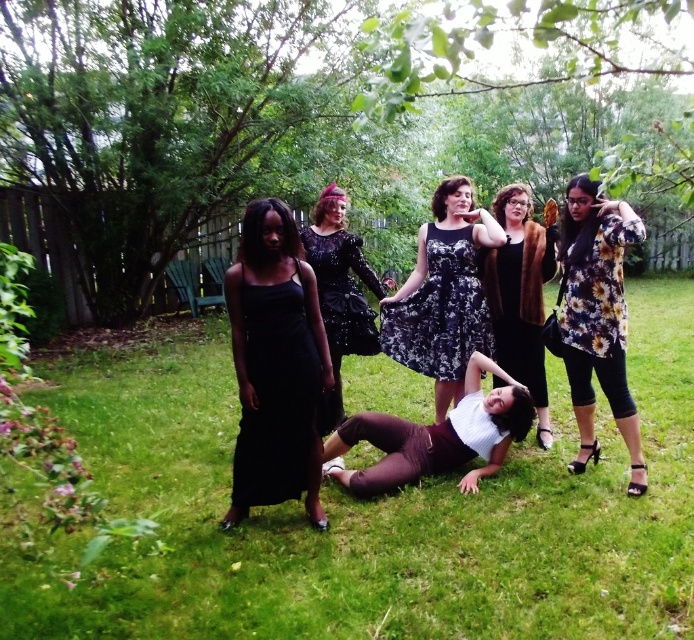
You are taking a photo of the group and want to focus on the floral print blouse at center and the floral fabric blouse at right. Which one is nearer to the camera?

The floral print blouse at center is closer to the viewer than the floral fabric blouse at right, so it is nearer to the camera.

You are a photographer planning to capture a closeup shot of the black sequined dress at center. Since you want to ensure the green grass at center is visible in the background, where should you position the dress relative to the grass?

The green grass at center is positioned on the right side of the black sequined dress at center, so to have the green grass at center visible in the background, you should position the dress to the left of the grass.